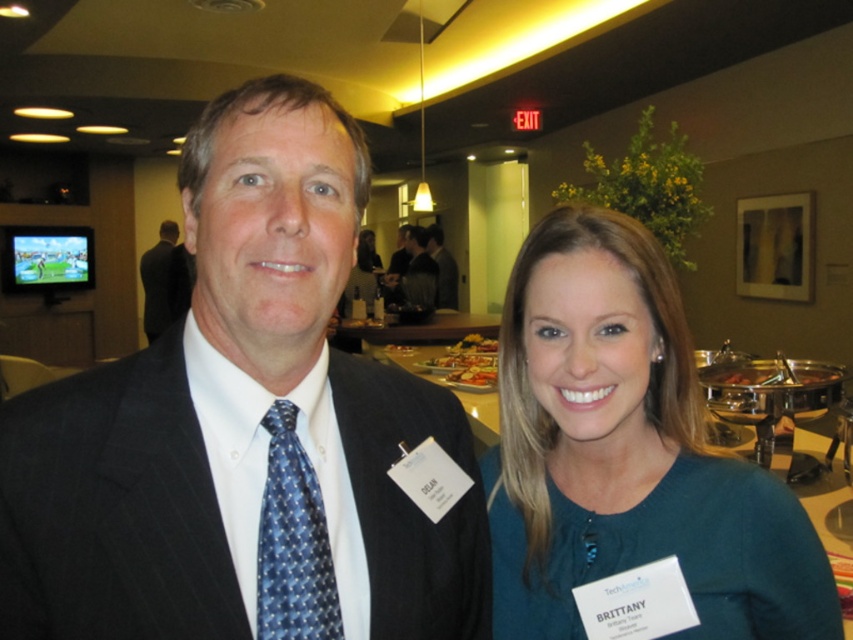
Question: Which of the following is the farthest from the observer?

Choices:
 (A) (433, 257)
 (B) (403, 278)
 (C) (467, 381)

Answer: (A)

Question: Which of the following is the closest to the observer?

Choices:
 (A) blue dotted tie at left
 (B) dark gray suit at center

Answer: (A)

Question: Can you confirm if shiny metallic platter at center is wider than blue dotted tie at center?

Choices:
 (A) yes
 (B) no

Answer: (B)

Question: Among these objects, which one is nearest to the camera?

Choices:
 (A) dark gray suit at center
 (B) dark blue textured suit at center

Answer: (B)

Question: Is teal sweater at center smaller than blue dotted tie at left?

Choices:
 (A) no
 (B) yes

Answer: (A)

Question: Does dark blue textured suit at center appear over dark gray suit at center?

Choices:
 (A) yes
 (B) no

Answer: (B)